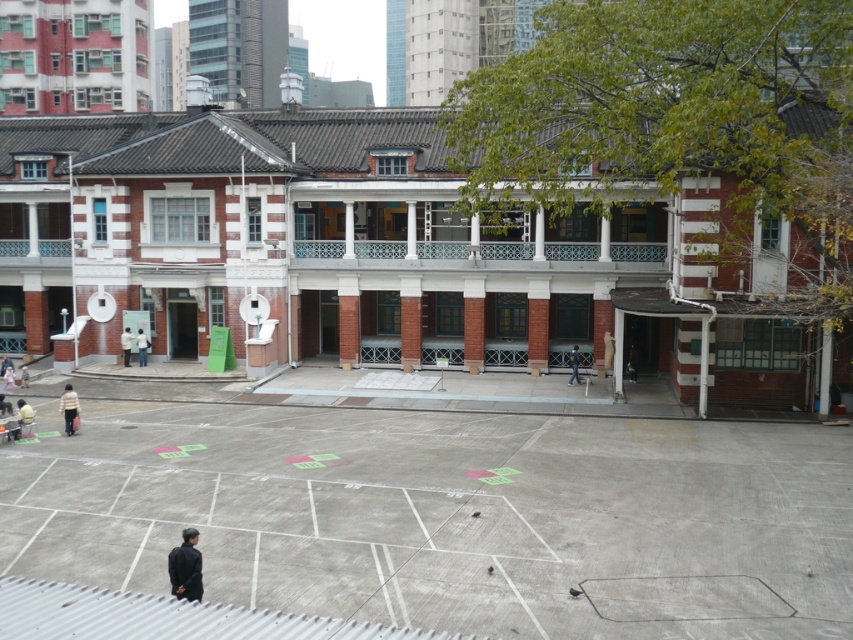
Based on the photo, you are standing at the entrance of the building and want to reach the concrete pavement at center. According to the coordinates provided, what direction should you move relative to your current position?

The concrete pavement at center is located at coordinates point (448,516), so you should move forward and to the right relative to your current position at the entrance.

You are standing at the entrance of the building and want to reach the point marked as point (136, 340). There is an obstacle at point (169, 579). Can you walk directly to your destination without going around the obstacle?

Point (169, 579) is in front of point (136, 340), so you cannot walk directly to point (136, 340) without going around the obstacle at point (169, 579).